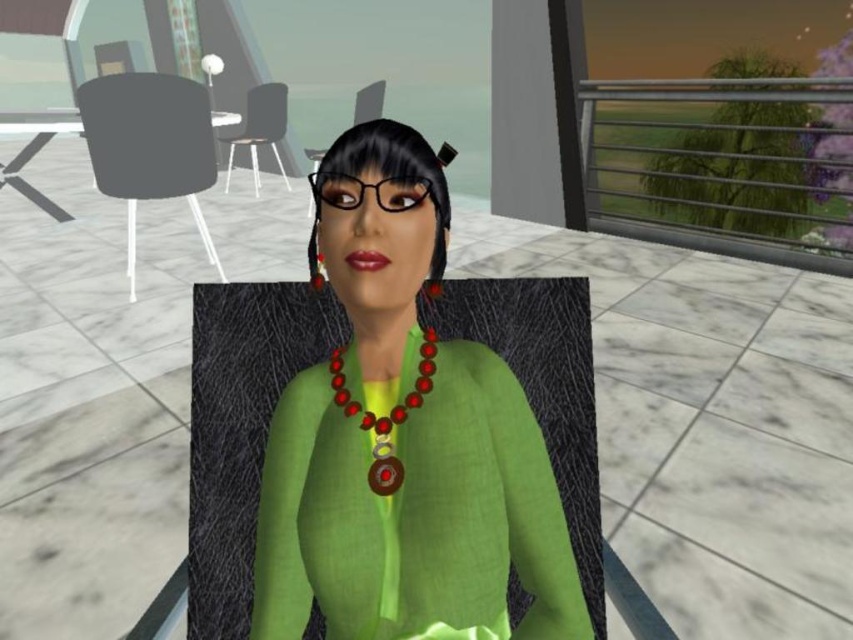
You are a furniture designer evaluating seating arrangements. You notice the matte black armchair at left and the green fabric armchair at center. Which chair has a higher seat height?

The green fabric armchair at center has a higher seat height than the matte black armchair at left.

You are a character in the scene and want to move from the matte black armchair at upper left to the green fabric armchair at center. Which direction should you move to reach it?

The green fabric armchair at center is behind the matte black armchair at upper left, so you should move backward to reach it.

You are designing a living room layout and have both the matte black armchair at left and the green fabric armchair at center. Which chair requires less space horizontally?

The matte black armchair at left has a lesser width compared to the green fabric armchair at center, so it requires less horizontal space.